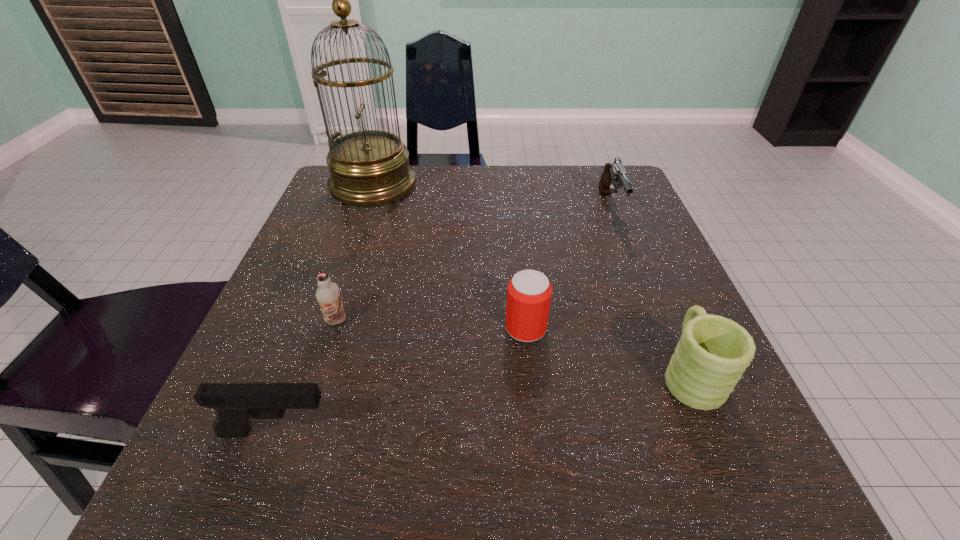
What are the coordinates of `the tallest object` in the screenshot? It's located at point(370,167).

Where is `the right pistol`? the right pistol is located at coordinates (614, 176).

I want to click on mug, so click(713, 352).

At what (x,y) coordinates should I click in order to perform the action: click on chocolate milk. Please return your answer as a coordinate pair (x, y). This screenshot has height=540, width=960. Looking at the image, I should click on (328, 294).

Where is `the third object from right to left`? Image resolution: width=960 pixels, height=540 pixels. the third object from right to left is located at coordinates (529, 292).

Locate an element on the screen. the nearer pistol is located at coordinates (235, 403).

This screenshot has width=960, height=540. I want to click on the left pistol, so click(x=235, y=403).

What are the coordinates of `free region located 0.050m with an open door on the birdcage` in the screenshot? It's located at (437, 185).

What are the coordinates of `free space located at the barrel of the right pistol` in the screenshot? It's located at (626, 247).

Locate an element on the screen. The image size is (960, 540). free point located on the side of the mug with the handle is located at coordinates (653, 286).